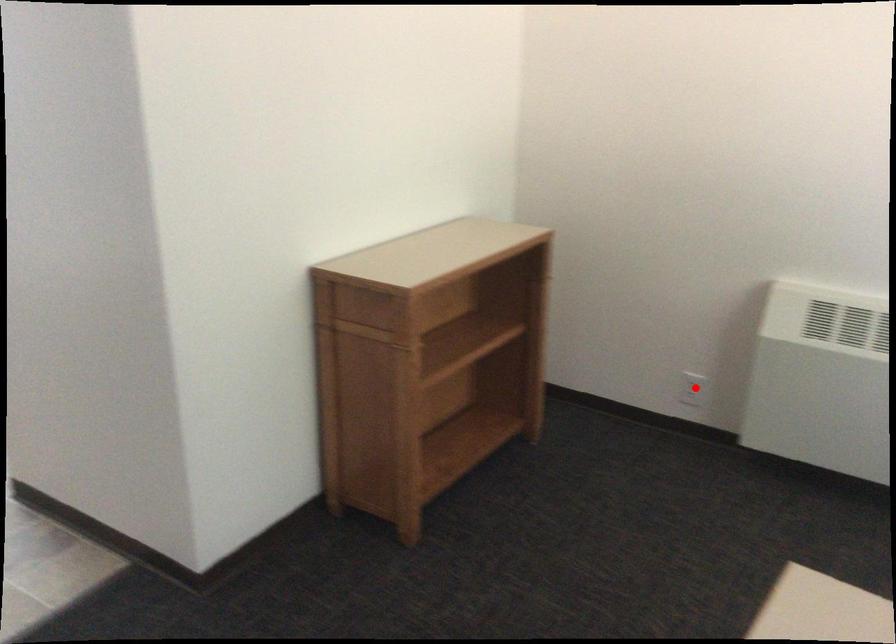
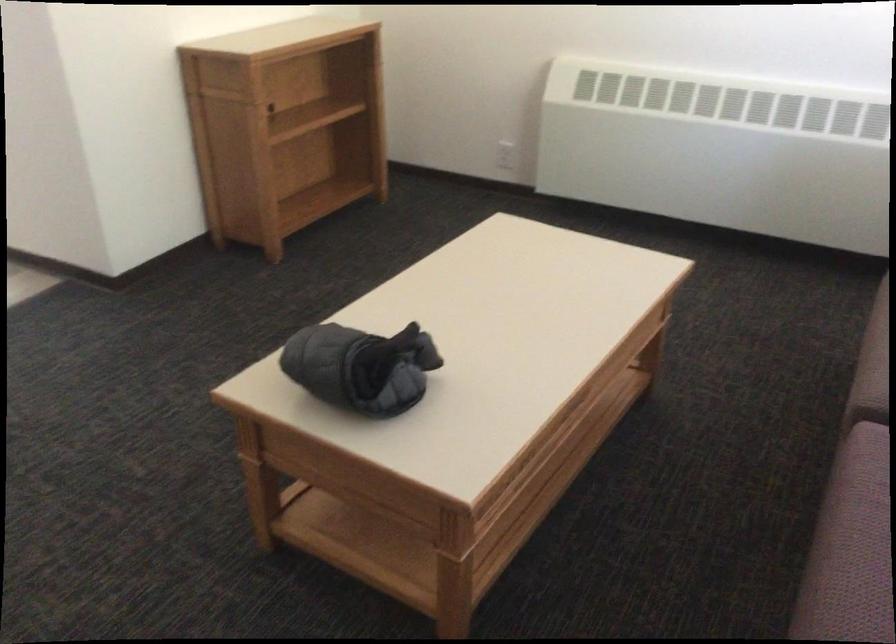
Question: I am providing you with two images of the same scene from different viewpoints. Given a red point in image1, look at the same physical point in image2. Is it:

Choices:
 (A) Closer to the viewpoint
 (B) Farther from the viewpoint

Answer: (B)